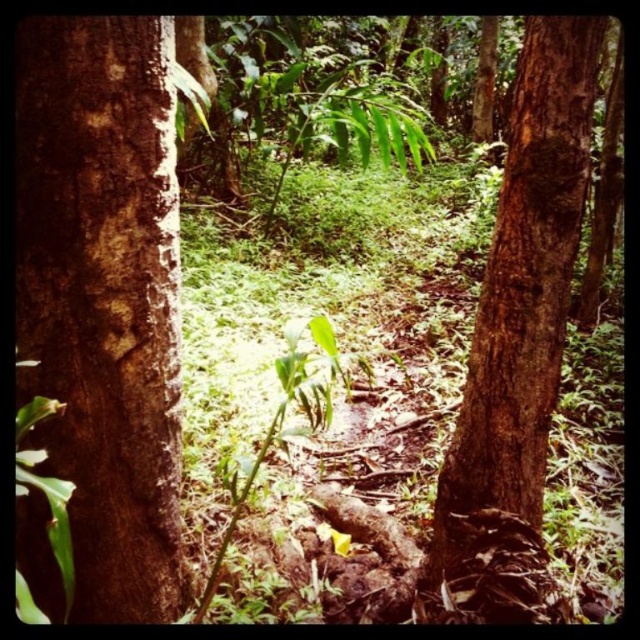
Question: Is brown rough bark at left below brown rough tree trunk at right?

Choices:
 (A) yes
 (B) no

Answer: (A)

Question: Is brown rough bark at left above brown rough tree trunk at right?

Choices:
 (A) yes
 (B) no

Answer: (B)

Question: Which of the following is the closest to the observer?

Choices:
 (A) (84, 323)
 (B) (536, 333)

Answer: (A)

Question: Is brown rough bark at left below brown rough tree trunk at right?

Choices:
 (A) no
 (B) yes

Answer: (B)

Question: Which point appears closest to the camera in this image?

Choices:
 (A) (88, 244)
 (B) (518, 173)

Answer: (A)